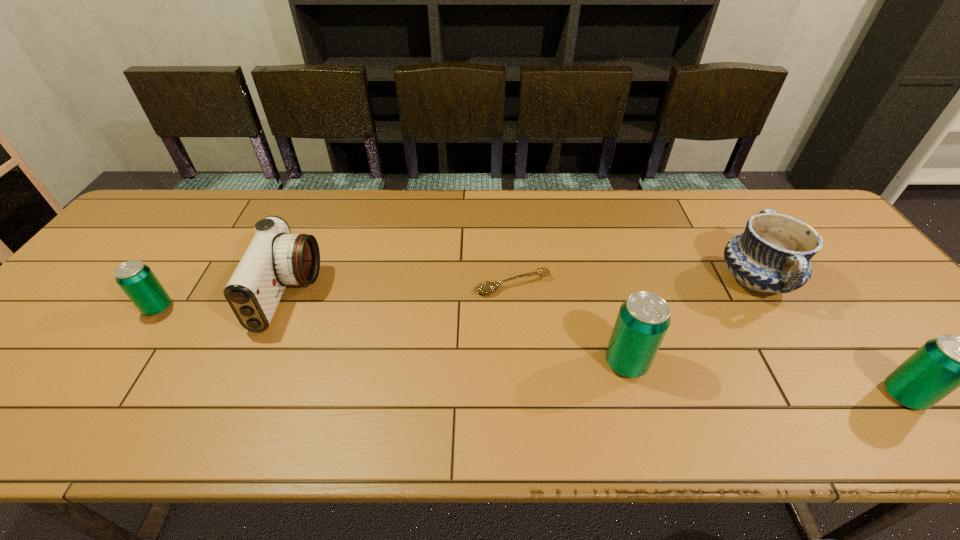
Locate an element on the screen. This screenshot has width=960, height=540. vacant space located 0.190m on the back of the third object from right to left is located at coordinates (605, 287).

Where is `vacant area situated 0.370m on the left of the second tallest beer can`? Image resolution: width=960 pixels, height=540 pixels. vacant area situated 0.370m on the left of the second tallest beer can is located at coordinates click(710, 395).

Locate an element on the screen. free space located on the back of the shortest object is located at coordinates (511, 258).

This screenshot has width=960, height=540. Identify the location of vacant area situated 0.070m on the surface of the camcorder. (342, 294).

This screenshot has height=540, width=960. I want to click on vacant area located on the back of the pottery, so click(714, 215).

Where is `object present at the right edge`? This screenshot has width=960, height=540. object present at the right edge is located at coordinates (941, 365).

Where is `object present at the near right corner`? The image size is (960, 540). object present at the near right corner is located at coordinates (941, 365).

Locate an element on the screen. The height and width of the screenshot is (540, 960). vacant region at the far edge of the desktop is located at coordinates (647, 191).

The height and width of the screenshot is (540, 960). In the image, there is a desktop. Find the location of `free space at the near edge`. free space at the near edge is located at coordinates (283, 384).

This screenshot has height=540, width=960. In order to click on free space at the left edge of the desktop in this screenshot , I will do `click(23, 353)`.